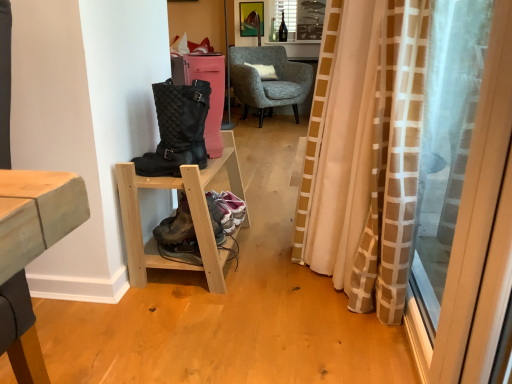
Question: Would you consider light wood/unfinished wood shelf at lower left to be distant from leather/mesh hiking boots at lower center?

Choices:
 (A) no
 (B) yes

Answer: (A)

Question: Is light wood/unfinished wood shelf at lower left shorter than leather/mesh hiking boots at lower center?

Choices:
 (A) yes
 (B) no

Answer: (B)

Question: Is light wood/unfinished wood shelf at lower left aimed at leather/mesh hiking boots at lower center?

Choices:
 (A) yes
 (B) no

Answer: (A)

Question: Does light wood/unfinished wood shelf at lower left have a greater width compared to leather/mesh hiking boots at lower center?

Choices:
 (A) no
 (B) yes

Answer: (B)

Question: From a real-world perspective, is light wood/unfinished wood shelf at lower left located higher than leather/mesh hiking boots at lower center?

Choices:
 (A) no
 (B) yes

Answer: (B)

Question: Does light wood/unfinished wood shelf at lower left appear on the right side of leather/mesh hiking boots at lower center?

Choices:
 (A) yes
 (B) no

Answer: (A)

Question: Is metallic gold picture frame at upper center oriented away from white soft cushion at center?

Choices:
 (A) yes
 (B) no

Answer: (B)

Question: Is metallic gold picture frame at upper center with white soft cushion at center?

Choices:
 (A) yes
 (B) no

Answer: (B)

Question: Can you confirm if metallic gold picture frame at upper center is taller than white soft cushion at center?

Choices:
 (A) no
 (B) yes

Answer: (B)

Question: Considering the relative positions of metallic gold picture frame at upper center and white soft cushion at center in the image provided, is metallic gold picture frame at upper center to the left of white soft cushion at center from the viewer's perspective?

Choices:
 (A) no
 (B) yes

Answer: (B)

Question: From a real-world perspective, is metallic gold picture frame at upper center positioned under white soft cushion at center based on gravity?

Choices:
 (A) yes
 (B) no

Answer: (B)

Question: Is white soft cushion at center a part of metallic gold picture frame at upper center?

Choices:
 (A) yes
 (B) no

Answer: (B)

Question: From the image's perspective, is light wood/unfinished wood shelf at lower left below metallic gold picture frame at upper center?

Choices:
 (A) yes
 (B) no

Answer: (A)